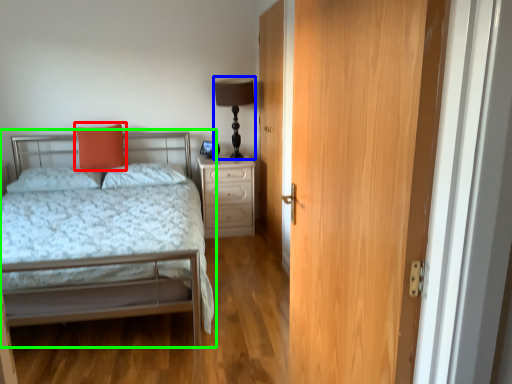
Question: Which is farther away from throw pillow (highlighted by a red box)? table lamp (highlighted by a blue box) or bed (highlighted by a green box)?

Choices:
 (A) table lamp
 (B) bed

Answer: (A)